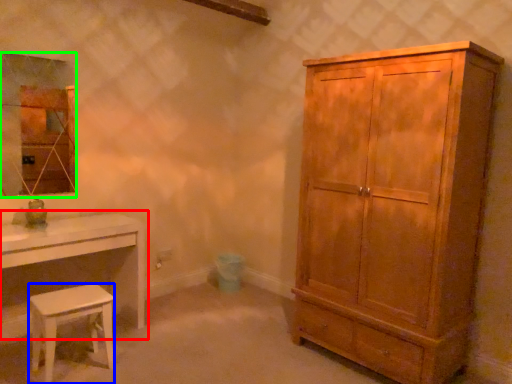
Question: Which object is the closest to the table (highlighted by a red box)? Choose among these: stool (highlighted by a blue box) or mirror (highlighted by a green box).

Choices:
 (A) stool
 (B) mirror

Answer: (A)